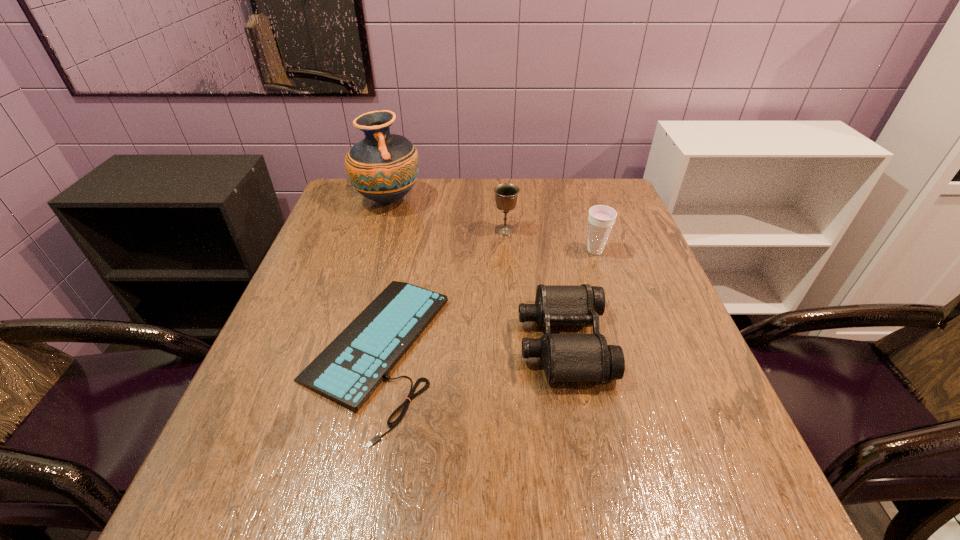
Locate an element on the screen. This screenshot has width=960, height=540. vacant area situated 0.200m through the eyepieces of the second shortest object is located at coordinates (424, 341).

The height and width of the screenshot is (540, 960). I want to click on vacant space situated through the eyepieces of the second shortest object, so click(x=429, y=341).

This screenshot has height=540, width=960. Identify the location of free location located through the eyepieces of the second shortest object. point(448,341).

Locate an element on the screen. The width and height of the screenshot is (960, 540). free spot located on the back of the shortest object is located at coordinates click(404, 223).

At what (x,y) coordinates should I click in order to perform the action: click on object located at the far edge. Please return your answer as a coordinate pair (x, y). Looking at the image, I should click on (383, 167).

Where is `pottery that is positioned at the left edge`? The image size is (960, 540). pottery that is positioned at the left edge is located at coordinates (383, 167).

Locate an element on the screen. This screenshot has width=960, height=540. computer keyboard situated at the left edge is located at coordinates (x=351, y=367).

At what (x,y) coordinates should I click in order to perform the action: click on object at the right edge. Please return your answer as a coordinate pair (x, y). The width and height of the screenshot is (960, 540). Looking at the image, I should click on (601, 219).

This screenshot has height=540, width=960. Identify the location of object that is at the far left corner. (383, 167).

What are the coordinates of `free space at the far edge` in the screenshot? It's located at (541, 212).